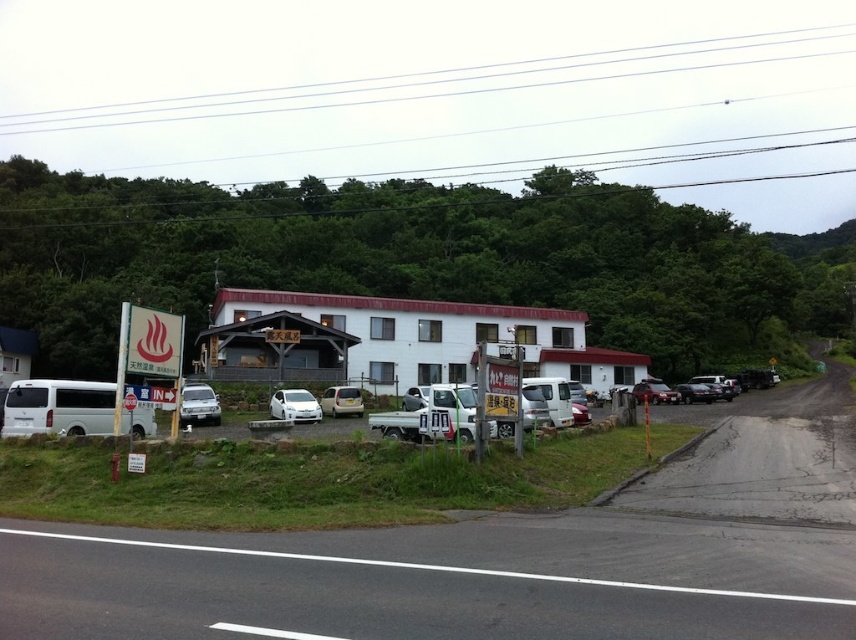
You are standing at the entrance of the guesthouse and want to take a photo of both the white matte car at lower left and the white matte car at center. Which car should you position yourself closer to in order to capture both in the same frame?

You should position yourself closer to the white matte car at lower left because it is nearer to you than the white matte car at center, allowing both cars to be included in the same frame without distortion.

You are standing at the entrance of the guesthouse and want to check if your car is parked within a safe distance for a quick access. The car you are looking for is the white matte car at lower left. According to safety guidelines, vehicles should be parked within 30 meters from the entrance. Is your car within the safe distance?

The white matte car at lower left is 28.61 meters away from the viewer, which is within the 30 meters safety guideline. Therefore, the car is parked within the safe distance.